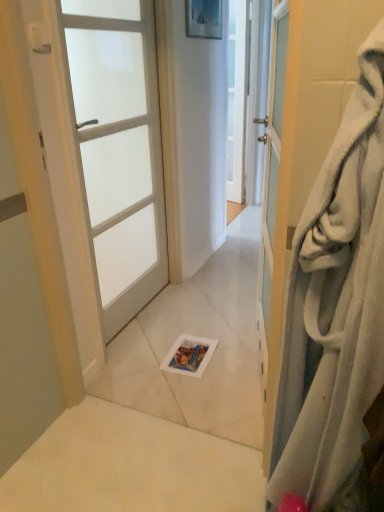
At what (x,y) coordinates should I click in order to perform the action: click on white frosted glass door at left, which appears as the 2th door when viewed from the right. Please return your answer as a coordinate pair (x, y). The height and width of the screenshot is (512, 384). Looking at the image, I should click on (119, 148).

What do you see at coordinates (119, 148) in the screenshot? The width and height of the screenshot is (384, 512). I see `white frosted glass door at left, acting as the 2th door starting from the front` at bounding box center [119, 148].

In order to face white fabric door at right, which ranks as the 1th door in front-to-back order, should I rotate leftwards or rightwards?

To align with it, rotate right about 19.798°.

This screenshot has width=384, height=512. What do you see at coordinates (309, 137) in the screenshot? I see `white fabric door at right, the second door viewed from the back` at bounding box center [309, 137].

At what (x,y) coordinates should I click in order to perform the action: click on white fabric door at right, the second door viewed from the back. Please return your answer as a coordinate pair (x, y). The image size is (384, 512). Looking at the image, I should click on (309, 137).

At what (x,y) coordinates should I click in order to perform the action: click on white frosted glass door at left, which appears as the 2th door when viewed from the right. Please return your answer as a coordinate pair (x, y). Looking at the image, I should click on (119, 148).

Between white frosted glass door at left, which is the first door in left-to-right order, and white fabric door at right, the second door viewed from the back, which one appears on the right side from the viewer's perspective?

white fabric door at right, the second door viewed from the back, is more to the right.

Relative to white fabric door at right, which appears as the second door when viewed from the left, is white frosted glass door at left, which is the first door in left-to-right order, in front or behind?

Visually, white frosted glass door at left, which is the first door in left-to-right order, is located behind white fabric door at right, which appears as the second door when viewed from the left.

Which is behind, point (100, 154) or point (281, 314)?

Positioned behind is point (100, 154).

From the image's perspective, is white frosted glass door at left, marked as the 1th door in a back-to-front arrangement, below white fabric door at right, which appears as the second door when viewed from the left?

Incorrect, from the image's perspective, white frosted glass door at left, marked as the 1th door in a back-to-front arrangement, is higher than white fabric door at right, which appears as the second door when viewed from the left.

From a real-world perspective, which object rests below the other?

In real-world perspective, white fabric door at right, the 1th door in the right-to-left sequence, is lower.

Considering the sizes of objects white frosted glass door at left, which is the first door in left-to-right order, and white fabric door at right, which ranks as the 1th door in front-to-back order, in the image provided, who is wider, white frosted glass door at left, which is the first door in left-to-right order, or white fabric door at right, which ranks as the 1th door in front-to-back order,?

With larger width is white fabric door at right, which ranks as the 1th door in front-to-back order.

Is white frosted glass door at left, marked as the 1th door in a back-to-front arrangement, taller than white fabric door at right, the 1th door in the right-to-left sequence?

Yes, white frosted glass door at left, marked as the 1th door in a back-to-front arrangement, is taller than white fabric door at right, the 1th door in the right-to-left sequence.

Considering the sizes of objects white frosted glass door at left, which appears as the 2th door when viewed from the right, and white fabric door at right, which ranks as the 1th door in front-to-back order, in the image provided, who is smaller, white frosted glass door at left, which appears as the 2th door when viewed from the right, or white fabric door at right, which ranks as the 1th door in front-to-back order,?

With smaller size is white frosted glass door at left, which appears as the 2th door when viewed from the right.

In the scene shown: Would you say white frosted glass door at left, which appears as the 2th door when viewed from the right, contains white fabric door at right, which ranks as the 1th door in front-to-back order?

No, white fabric door at right, which ranks as the 1th door in front-to-back order, is not a part of white frosted glass door at left, which appears as the 2th door when viewed from the right.

Is white frosted glass door at left, which is the first door in left-to-right order, far from white fabric door at right, which appears as the second door when viewed from the left?

Absolutely, white frosted glass door at left, which is the first door in left-to-right order, is distant from white fabric door at right, which appears as the second door when viewed from the left.

Could you tell me if white frosted glass door at left, which is the first door in left-to-right order, is facing white fabric door at right, the 1th door in the right-to-left sequence?

No, white frosted glass door at left, which is the first door in left-to-right order, is not oriented towards white fabric door at right, the 1th door in the right-to-left sequence.

What's the angular difference between white frosted glass door at left, acting as the 2th door starting from the front, and white fabric door at right, the 1th door in the right-to-left sequence,'s facing directions?

The facing directions of white frosted glass door at left, acting as the 2th door starting from the front, and white fabric door at right, the 1th door in the right-to-left sequence, are 179 degrees apart.

At what (x,y) coordinates should I click in order to perform the action: click on door located above the white fabric door at right, the second door viewed from the back (from a real-world perspective). Please return your answer as a coordinate pair (x, y). Image resolution: width=384 pixels, height=512 pixels. Looking at the image, I should click on (119, 148).

Does white fabric door at right, which ranks as the 1th door in front-to-back order, appear on the right side of white frosted glass door at left, marked as the 1th door in a back-to-front arrangement?

Yes.

Does white fabric door at right, which appears as the second door when viewed from the left, come behind white frosted glass door at left, marked as the 1th door in a back-to-front arrangement?

No.

Is point (298, 52) less distant than point (142, 38)?

Yes, it is in front of point (142, 38).

Based on the photo, from the image's perspective, which one is positioned lower, white fabric door at right, which ranks as the 1th door in front-to-back order, or white frosted glass door at left, which appears as the 2th door when viewed from the right?

white fabric door at right, which ranks as the 1th door in front-to-back order.

From a real-world perspective, is white fabric door at right, which ranks as the 1th door in front-to-back order, positioned over white frosted glass door at left, acting as the 2th door starting from the front, based on gravity?

No, from a real-world perspective, white fabric door at right, which ranks as the 1th door in front-to-back order, is not on top of white frosted glass door at left, acting as the 2th door starting from the front.

Can you confirm if white fabric door at right, the second door viewed from the back, is wider than white frosted glass door at left, acting as the 2th door starting from the front?

Yes, white fabric door at right, the second door viewed from the back, is wider than white frosted glass door at left, acting as the 2th door starting from the front.

Considering the sizes of white fabric door at right, the 1th door in the right-to-left sequence, and white frosted glass door at left, marked as the 1th door in a back-to-front arrangement, in the image, is white fabric door at right, the 1th door in the right-to-left sequence, taller or shorter than white frosted glass door at left, marked as the 1th door in a back-to-front arrangement,?

Clearly, white fabric door at right, the 1th door in the right-to-left sequence, is shorter compared to white frosted glass door at left, marked as the 1th door in a back-to-front arrangement.

Does white fabric door at right, the 1th door in the right-to-left sequence, have a smaller size compared to white frosted glass door at left, marked as the 1th door in a back-to-front arrangement?

No.

Looking at this image, would you say white fabric door at right, the second door viewed from the back, is inside or outside white frosted glass door at left, marked as the 1th door in a back-to-front arrangement?

white fabric door at right, the second door viewed from the back, is spatially situated outside white frosted glass door at left, marked as the 1th door in a back-to-front arrangement.

Is white fabric door at right, which ranks as the 1th door in front-to-back order, not near white frosted glass door at left, which appears as the 2th door when viewed from the right?

Yes, white fabric door at right, which ranks as the 1th door in front-to-back order, and white frosted glass door at left, which appears as the 2th door when viewed from the right, are quite far apart.

Is white fabric door at right, the 1th door in the right-to-left sequence, positioned with its back to white frosted glass door at left, which appears as the 2th door when viewed from the right?

That's not correct — white fabric door at right, the 1th door in the right-to-left sequence, is not looking away from white frosted glass door at left, which appears as the 2th door when viewed from the right.

Where is `door on the right of white frosted glass door at left, marked as the 1th door in a back-to-front arrangement`? door on the right of white frosted glass door at left, marked as the 1th door in a back-to-front arrangement is located at coordinates (309, 137).

Locate an element on the screen. door on the left of white fabric door at right, which appears as the second door when viewed from the left is located at coordinates (x=119, y=148).

Find the location of `door above the white fabric door at right, the 1th door in the right-to-left sequence (from a real-world perspective)`. door above the white fabric door at right, the 1th door in the right-to-left sequence (from a real-world perspective) is located at coordinates (119, 148).